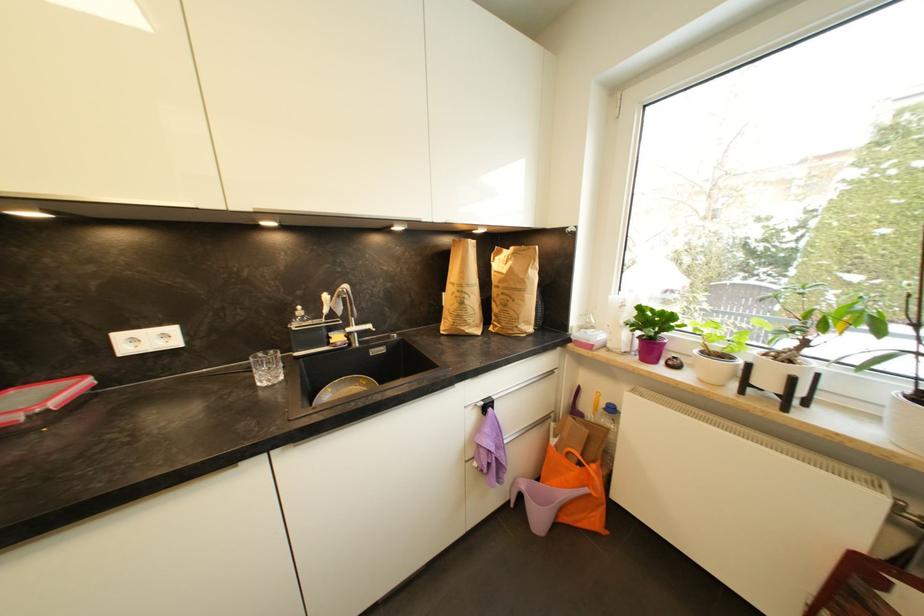
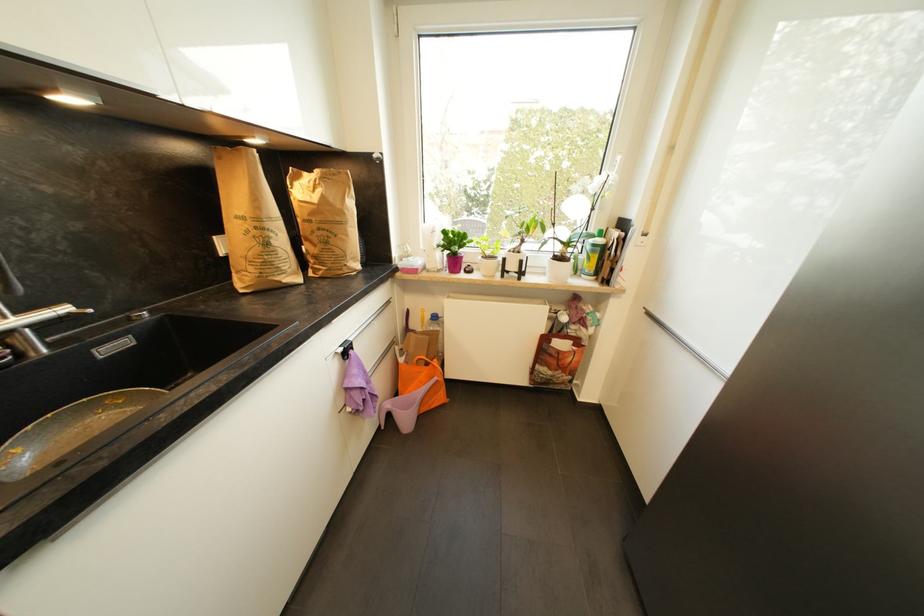
In the second image, find the point that corresponds to the point at 645,310 in the first image.

(450, 233)